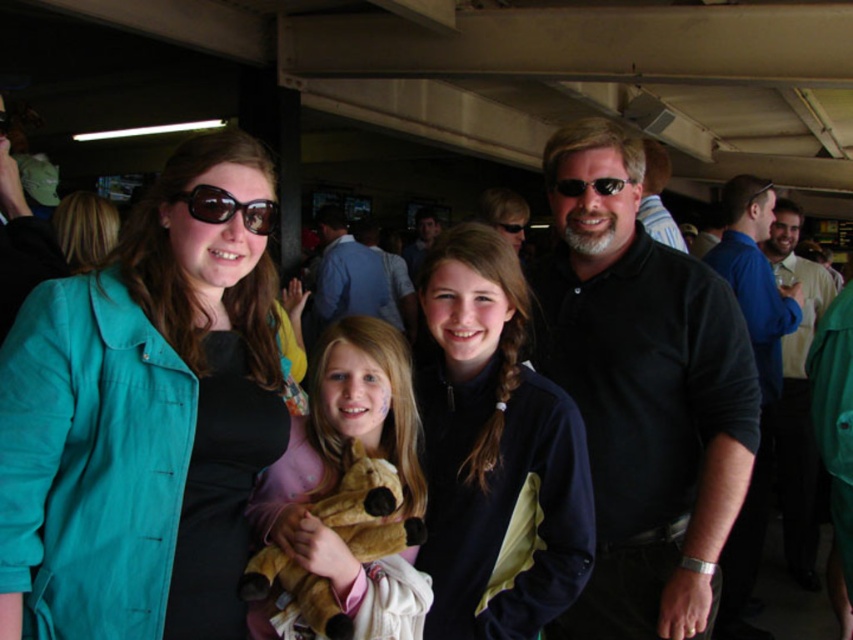
You are a photographer trying to capture a closeup of the soft pink plush at center and the sunglasses at center. Which object should you focus on first to ensure it appears sharp in the photo?

The soft pink plush at center is closer to the viewer than the sunglasses at center, so you should focus on the soft pink plush at center first to ensure it appears sharp.

You are a photographer at the event and want to ensure both the soft pink plush at center and the sunglasses at center are visible in the photo. Given their sizes, which object might require you to adjust your camera angle to avoid being too large in the frame?

The soft pink plush at center is bigger than sunglasses at center, so the photographer should adjust the camera angle to prevent the soft pink plush at center from dominating the frame.

You are standing at the point marked as point [796,396]. What object are you touching?

The point [796,396] is on the blue shirt at right, so you are touching the blue shirt at right.